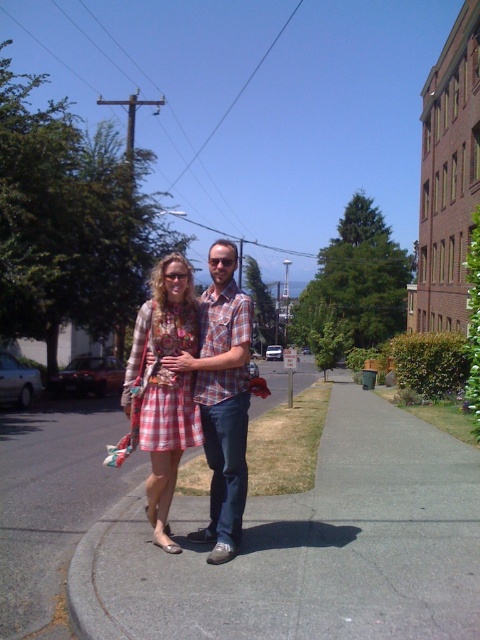
Does point (343, 636) lie in front of point (218, 257)?

Yes, it is in front of point (218, 257).

Between point (380, 476) and point (228, 460), which one is positioned behind?

The point (380, 476) is behind.

Locate an element on the screen. gray asphalt sidewalk at center is located at coordinates (309, 547).

Which is more to the right, gray asphalt sidewalk at center or floral-patterned dress at center?

Positioned to the right is gray asphalt sidewalk at center.

Is gray asphalt sidewalk at center shorter than floral-patterned dress at center?

Correct, gray asphalt sidewalk at center is not as tall as floral-patterned dress at center.

Which is behind, point (343, 372) or point (192, 310)?

The point (343, 372) is behind.

At what (x,y) coordinates should I click in order to perform the action: click on gray asphalt sidewalk at center. Please return your answer as a coordinate pair (x, y). The width and height of the screenshot is (480, 640). Looking at the image, I should click on (309, 547).

Between plaid shirt at center and floral-patterned dress at center, which one has more height?

With more height is floral-patterned dress at center.

Describe the element at coordinates (222, 397) in the screenshot. I see `plaid shirt at center` at that location.

At what (x,y) coordinates should I click in order to perform the action: click on plaid shirt at center. Please return your answer as a coordinate pair (x, y). Looking at the image, I should click on (222, 397).